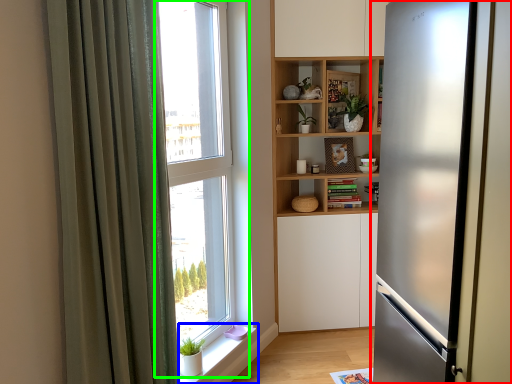
Question: Estimate the real-world distances between objects in this image. Which object is closer to refrigerator (highlighted by a red box), window sill (highlighted by a blue box) or window (highlighted by a green box)?

Choices:
 (A) window sill
 (B) window

Answer: (B)